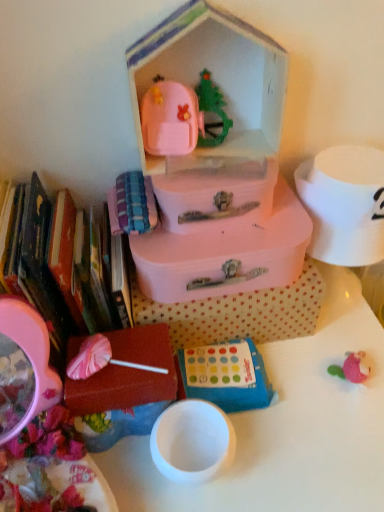
Question: Can you confirm if white glossy table at center is bigger than pink matte lollipop at lower left, the 1th storage box ordered from the bottom?

Choices:
 (A) yes
 (B) no

Answer: (A)

Question: Could you tell me if white glossy table at center is facing pink matte lollipop at lower left, which is counted as the 4th storage box, starting from the top?

Choices:
 (A) yes
 (B) no

Answer: (B)

Question: Is white glossy table at center at the right side of pink matte lollipop at lower left, the 1th storage box ordered from the bottom?

Choices:
 (A) yes
 (B) no

Answer: (A)

Question: Does white glossy table at center lie in front of pink matte lollipop at lower left, the 1th storage box ordered from the bottom?

Choices:
 (A) no
 (B) yes

Answer: (B)

Question: Would you consider white glossy table at center to be distant from pink matte lollipop at lower left, the 1th storage box ordered from the bottom?

Choices:
 (A) no
 (B) yes

Answer: (A)

Question: Looking at their shapes, would you say matte pink suitcase at center, arranged as the second storage box when viewed from the top, is wider or thinner than pink matte suitcase at center, the 2th storage box in the bottom-to-top sequence?

Choices:
 (A) thin
 (B) wide

Answer: (B)

Question: In terms of height, does matte pink suitcase at center, arranged as the 3th storage box when ordered from the bottom, look taller or shorter compared to pink matte suitcase at center, the 2th storage box in the bottom-to-top sequence?

Choices:
 (A) short
 (B) tall

Answer: (A)

Question: From the image's perspective, is matte pink suitcase at center, arranged as the second storage box when viewed from the top, located above or below pink matte suitcase at center, the third storage box positioned from the top?

Choices:
 (A) above
 (B) below

Answer: (A)

Question: Is point (185, 282) positioned closer to the camera than point (205, 305)?

Choices:
 (A) closer
 (B) farther

Answer: (A)

Question: From the image's perspective, is matte pink suitcase at center, arranged as the second storage box when viewed from the top, located above or below pink plastic suitcase at upper center?

Choices:
 (A) above
 (B) below

Answer: (B)

Question: Is matte pink suitcase at center, arranged as the 3th storage box when ordered from the bottom, inside the boundaries of pink plastic suitcase at upper center, or outside?

Choices:
 (A) outside
 (B) inside

Answer: (A)

Question: From their relative heights in the image, would you say matte pink suitcase at center, arranged as the second storage box when viewed from the top, is taller or shorter than pink plastic suitcase at upper center?

Choices:
 (A) tall
 (B) short

Answer: (B)

Question: Looking at the image, does matte pink suitcase at center, arranged as the 3th storage box when ordered from the bottom, seem bigger or smaller compared to pink plastic suitcase at upper center?

Choices:
 (A) small
 (B) big

Answer: (A)

Question: Considering the positions of blue fabric game at center and matte pink suitcase at center, positioned as the 1th storage box in top-to-bottom order, in the image, is blue fabric game at center taller or shorter than matte pink suitcase at center, positioned as the 1th storage box in top-to-bottom order,?

Choices:
 (A) short
 (B) tall

Answer: (A)

Question: Choose the correct answer: Is blue fabric game at center inside matte pink suitcase at center, positioned as the 1th storage box in top-to-bottom order, or outside it?

Choices:
 (A) inside
 (B) outside

Answer: (B)